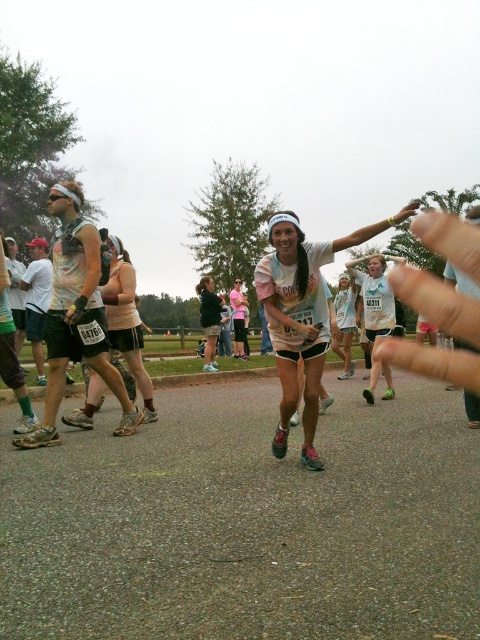
Question: Does rainbow tie-dye shirt at center lie behind matte tie-dye tank top at left?

Choices:
 (A) yes
 (B) no

Answer: (B)

Question: Is rainbow tie-dye shirt at center to the left of matte tie-dye tank top at left from the viewer's perspective?

Choices:
 (A) yes
 (B) no

Answer: (B)

Question: In this image, where is rainbow tie-dye shirt at center located relative to matte tie-dye tank top at left?

Choices:
 (A) right
 (B) left

Answer: (A)

Question: Which point is closer to the camera?

Choices:
 (A) rainbow tie-dye shirt at center
 (B) matte tie-dye tank top at left

Answer: (A)

Question: Which object is farther from the camera taking this photo?

Choices:
 (A) rainbow tie-dye shirt at center
 (B) matte tie-dye tank top at left

Answer: (B)